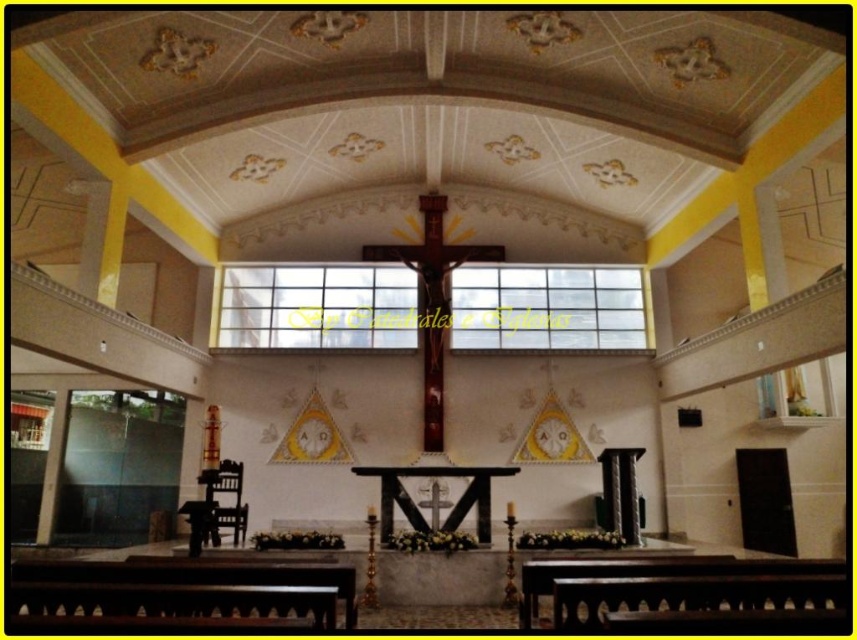
You are a visitor to the church and want to sit down. You see the brown wooden bench at lower left and the black polished wood altar at center. Which object is wider?

The brown wooden bench at lower left is wider than the black polished wood altar at center according to the description.

You are standing in the church and want to sit down. There is a brown wooden bench at lower center and a black polished wood altar at center. Which object is closer to you?

The brown wooden bench at lower center is closer to the viewer than the black polished wood altar at center.

You are an event organizer planning to seat guests in the church. You have two brown wooden benches available. Which bench, the brown wooden bench at lower left or the brown wooden bench at lower center, can accommodate more people?

The brown wooden bench at lower left can accommodate more people because its width surpasses that of the brown wooden bench at lower center.